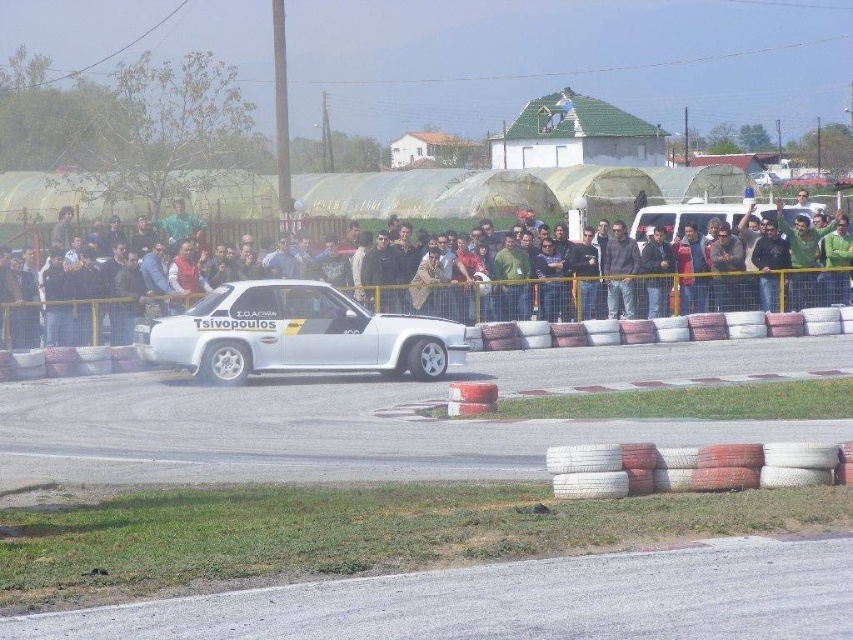
Is white rubber tire at center above silver metallic tire at center?

Incorrect, white rubber tire at center is not positioned above silver metallic tire at center.

Can you confirm if white rubber tire at center is positioned to the right of silver metallic tire at center?

In fact, white rubber tire at center is to the left of silver metallic tire at center.

You are a GUI agent. You are given a task and a screenshot of the screen. Output one action in this format:
    pyautogui.click(x=<x>, y=<y>)
    Task: Click on the white rubber tire at center
    The width and height of the screenshot is (853, 640).
    Given the screenshot: What is the action you would take?
    (x=224, y=362)

Between point (218, 339) and point (131, 305), which one is positioned in front?

Point (218, 339) is in front.

Does white glossy car at center have a larger size compared to white matte car at center?

Incorrect, white glossy car at center is not larger than white matte car at center.

Image resolution: width=853 pixels, height=640 pixels. What do you see at coordinates (289, 332) in the screenshot? I see `white glossy car at center` at bounding box center [289, 332].

Find the location of a particular element. Image resolution: width=853 pixels, height=640 pixels. white glossy car at center is located at coordinates (289, 332).

Does white glossy car at center have a lesser width compared to silver metallic tire at center?

No.

Does white glossy car at center have a larger size compared to silver metallic tire at center?

Correct, white glossy car at center is larger in size than silver metallic tire at center.

At what (x,y) coordinates should I click in order to perform the action: click on white glossy car at center. Please return your answer as a coordinate pair (x, y). Looking at the image, I should click on (289, 332).